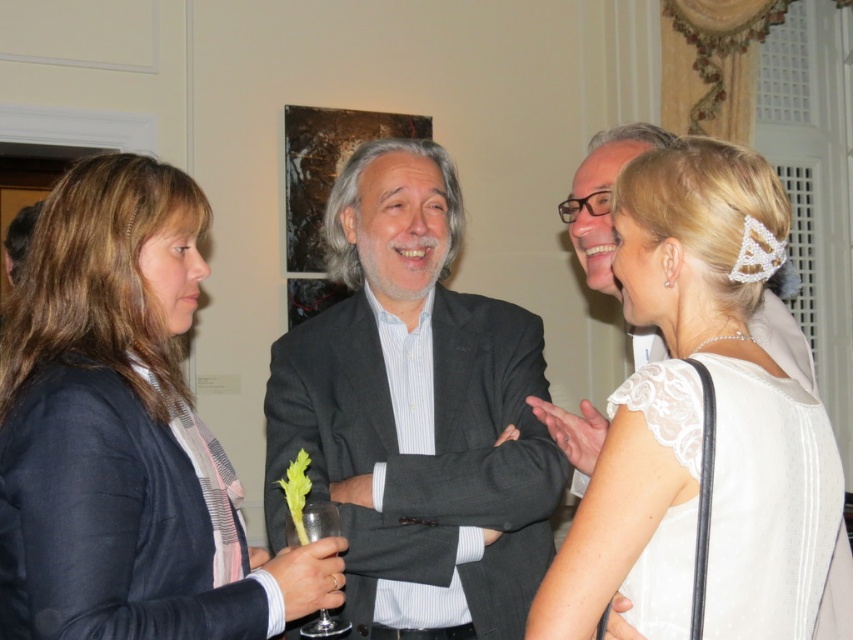
Can you confirm if matte black blazer at left is shorter than dark gray suit at center?

Indeed, matte black blazer at left has a lesser height compared to dark gray suit at center.

This screenshot has width=853, height=640. What do you see at coordinates (125, 433) in the screenshot?
I see `matte black blazer at left` at bounding box center [125, 433].

Who is more distant from viewer, (158, 528) or (496, 436)?

Point (496, 436)

Identify the location of matte black blazer at left. (125, 433).

Who is more forward, (416,452) or (695,285)?

Positioned in front is point (695,285).

Who is more forward, (347, 314) or (653, 266)?

Point (653, 266)

At what (x,y) coordinates should I click in order to perform the action: click on dark gray suit at center. Please return your answer as a coordinate pair (x, y). This screenshot has height=640, width=853. Looking at the image, I should click on (416, 413).

Between point (346, 212) and point (305, 529), which one is positioned in front?

Positioned in front is point (305, 529).

Is point (453, 588) farther from viewer compared to point (309, 518)?

Yes.

What are the coordinates of `dark gray suit at center` in the screenshot? It's located at (416, 413).